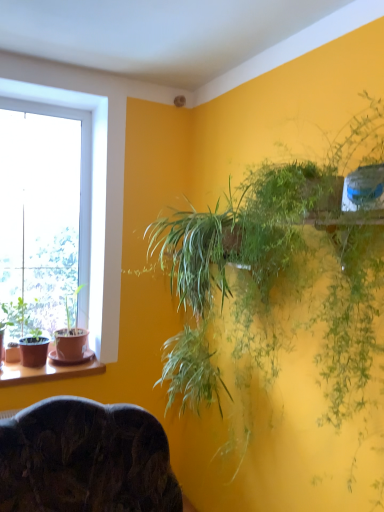
Question: Looking at their shapes, would you say green leafy plant at upper right, the 1th houseplant positioned from the front, is wider or thinner than green matte pot at left, arranged as the second houseplant when viewed from the back?

Choices:
 (A) thin
 (B) wide

Answer: (B)

Question: From a real-world perspective, relative to green matte pot at left, the second houseplant when ordered from front to back, is green leafy plant at upper right, the 1th houseplant positioned from the front, vertically above or below?

Choices:
 (A) below
 (B) above

Answer: (B)

Question: Which is nearer to the dark wood chair at lower center?

Choices:
 (A) transparent glass window at left
 (B) brown wooden window sill at lower left
 (C) green matte pot at left, the second houseplant when ordered from front to back
 (D) matte brown pot at left, which ranks as the 3th houseplant in front-to-back order
 (E) green leafy plant at upper right, the 1th houseplant viewed from the right

Answer: (B)

Question: Which object is positioned farthest from the green matte pot at left, arranged as the second houseplant when viewed from the back?

Choices:
 (A) green leafy plant at upper right, the 1th houseplant positioned from the front
 (B) matte brown pot at left, which appears as the second houseplant when viewed from the right
 (C) brown wooden window sill at lower left
 (D) dark wood chair at lower center
 (E) transparent glass window at left

Answer: (A)